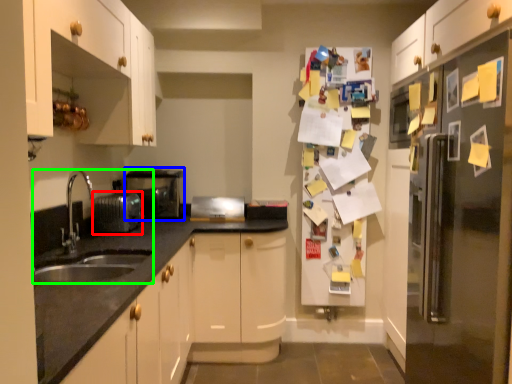
Question: Which object is the closest to the appliance (highlighted by a red box)? Choose among these: appliance (highlighted by a blue box) or sink (highlighted by a green box).

Choices:
 (A) appliance
 (B) sink

Answer: (B)